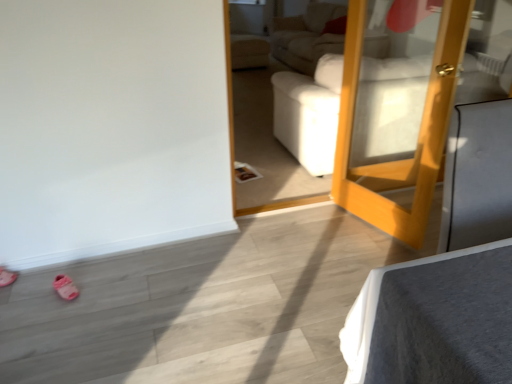
This screenshot has width=512, height=384. What are the coordinates of `vacant region to the left of pink fabric shoe at lower left, which ranks as the first shoe in right-to-left order` in the screenshot? It's located at (30, 288).